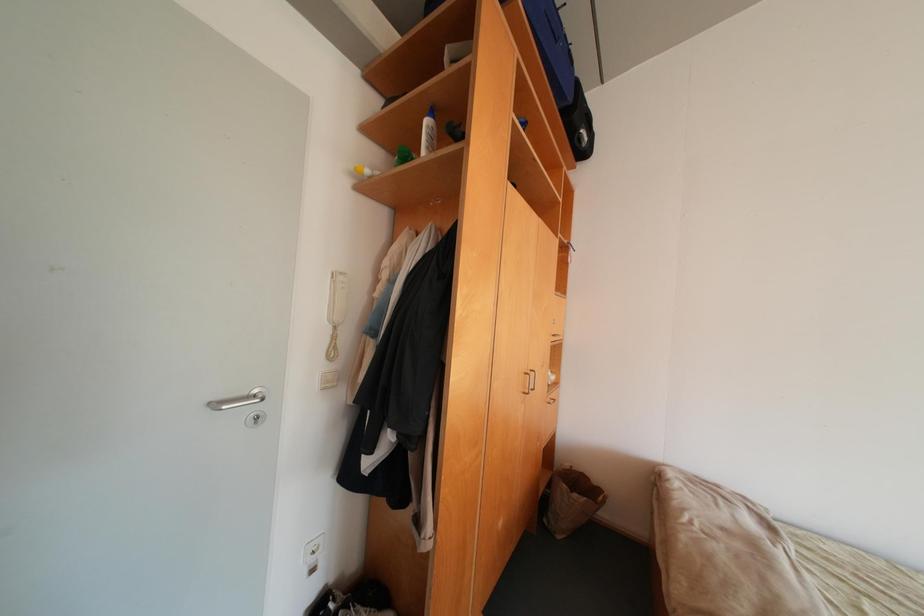
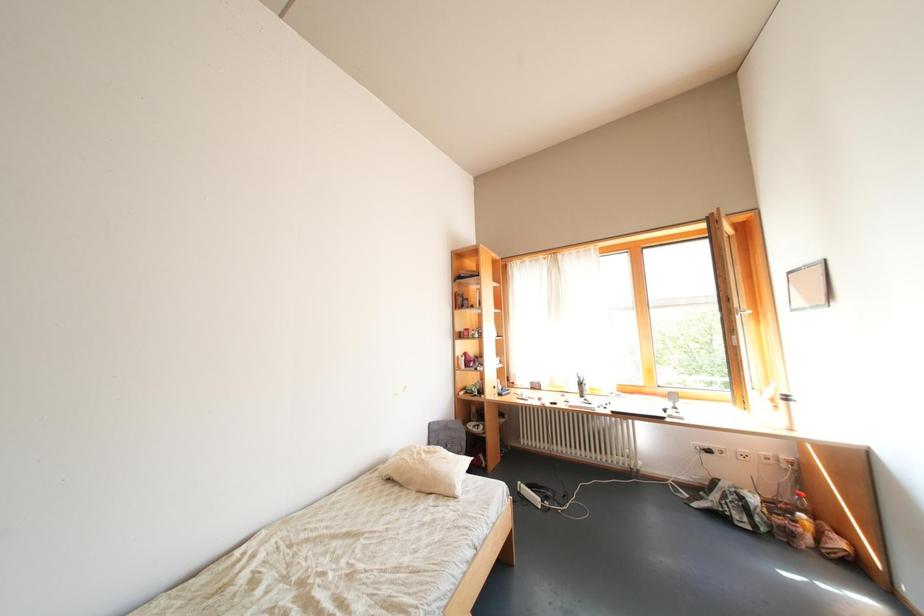
Question: The camera is either moving clockwise (left) or counter-clockwise (right) around the object. The first image is from the beginning of the video and the second image is from the end. Is the camera moving left or right when shooting the video?

Choices:
 (A) Left
 (B) Right

Answer: (A)